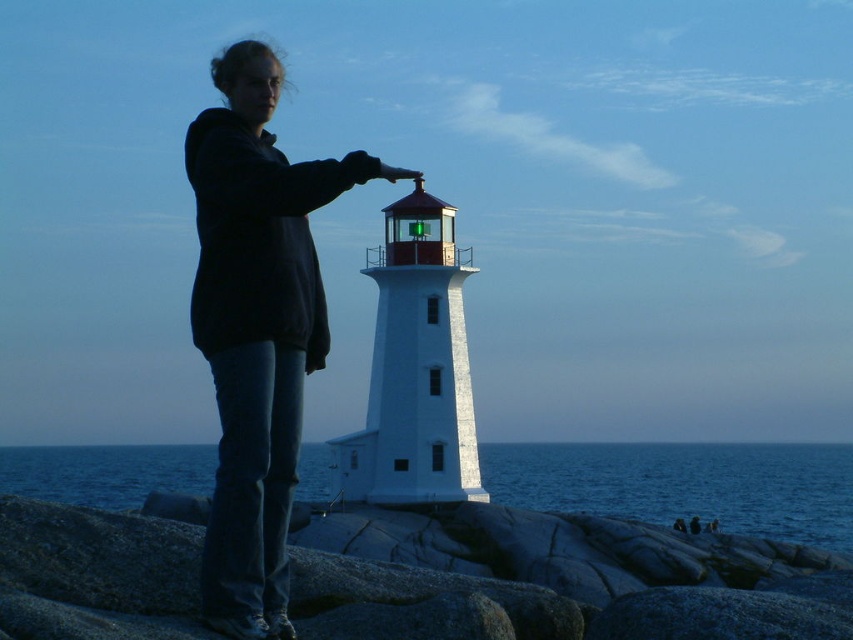
Does granite rocks at center appear under dark blue hoodie at center?

Correct, granite rocks at center is located below dark blue hoodie at center.

At what (x,y) coordinates should I click in order to perform the action: click on granite rocks at center. Please return your answer as a coordinate pair (x, y). Looking at the image, I should click on (582, 593).

Can you confirm if dark blue hoodie at center is positioned above blue water at lower center?

Yes, dark blue hoodie at center is above blue water at lower center.

Is point (276, 467) in front of point (735, 490)?

That is True.

Locate an element on the screen. dark blue hoodie at center is located at coordinates (256, 328).

Does granite rocks at center have a greater width compared to blue water at lower center?

Incorrect, granite rocks at center's width does not surpass blue water at lower center's.

Between point (335, 572) and point (711, 512), which one is positioned behind?

Positioned behind is point (711, 512).

At what (x,y) coordinates should I click in order to perform the action: click on granite rocks at center. Please return your answer as a coordinate pair (x, y). The image size is (853, 640). Looking at the image, I should click on (582, 593).